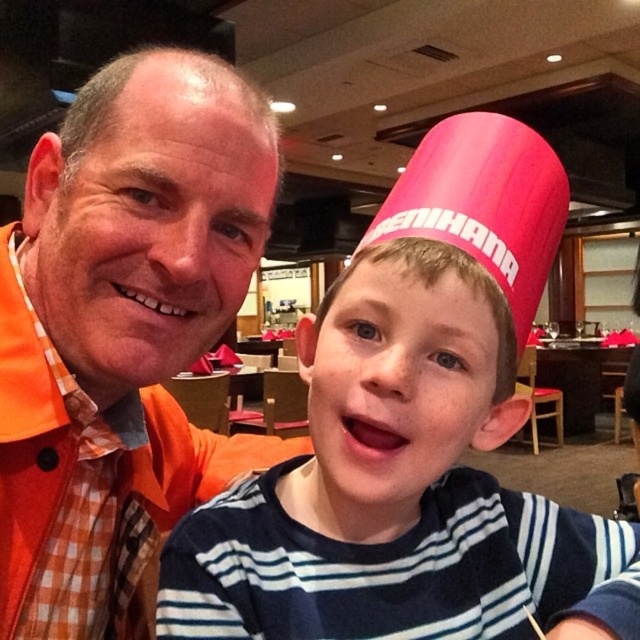
Question: Can you confirm if pink fabric hat at upper right is bigger than orange checkered shirt at left?

Choices:
 (A) yes
 (B) no

Answer: (A)

Question: Which object is closer to the camera taking this photo?

Choices:
 (A) orange checkered shirt at left
 (B) pink fabric hat at upper right

Answer: (B)

Question: Which object is closer to the camera taking this photo?

Choices:
 (A) orange checkered shirt at left
 (B) pink fabric hat at upper right

Answer: (B)

Question: Is pink fabric hat at upper right wider than orange checkered shirt at left?

Choices:
 (A) yes
 (B) no

Answer: (A)

Question: Is pink fabric hat at upper right positioned at the back of orange checkered shirt at left?

Choices:
 (A) no
 (B) yes

Answer: (A)